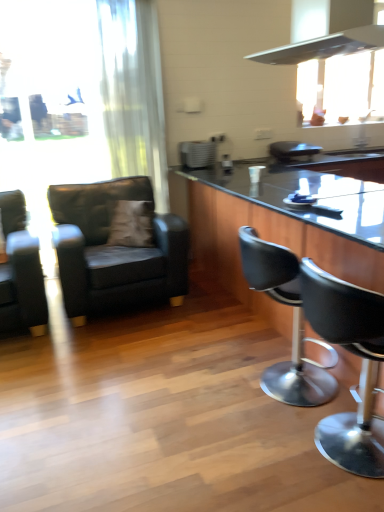
Question: Is black leather bar stool at center, positioned as the 2th chair in right-to-left order, in front of or behind satin silver toaster at center in the image?

Choices:
 (A) behind
 (B) front

Answer: (B)

Question: Is black leather bar stool at center, the third chair from the left, wider or thinner than satin silver toaster at center?

Choices:
 (A) thin
 (B) wide

Answer: (B)

Question: Estimate the real-world distances between objects in this image. Which object is farther from the black leather bar stool at center, the third chair from the left?

Choices:
 (A) matte black armchair at left, the 4th chair when ordered from right to left
 (B) black leather bar stool at right, marked as the first chair in a right-to-left arrangement
 (C) black glossy countertop at center
 (D) matte black armchair at left, positioned as the second chair in left-to-right order
 (E) metallic silver range hood at upper right

Answer: (A)

Question: Estimate the real-world distances between objects in this image. Which object is closer to the matte black armchair at left, marked as the 3th chair in a right-to-left arrangement?

Choices:
 (A) matte black armchair at left, the 4th chair when ordered from right to left
 (B) black glossy table at center
 (C) black leather bar stool at center, positioned as the 2th chair in right-to-left order
 (D) brown suede pillow at center
 (E) black leather bar stool at right, marked as the first chair in a right-to-left arrangement

Answer: (D)